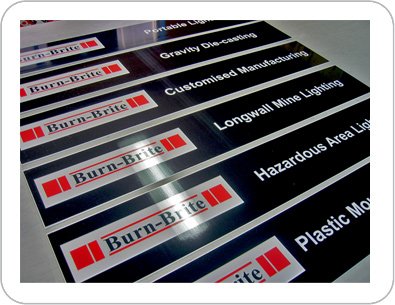
Where is `table`? The width and height of the screenshot is (395, 305). table is located at coordinates (341, 47).